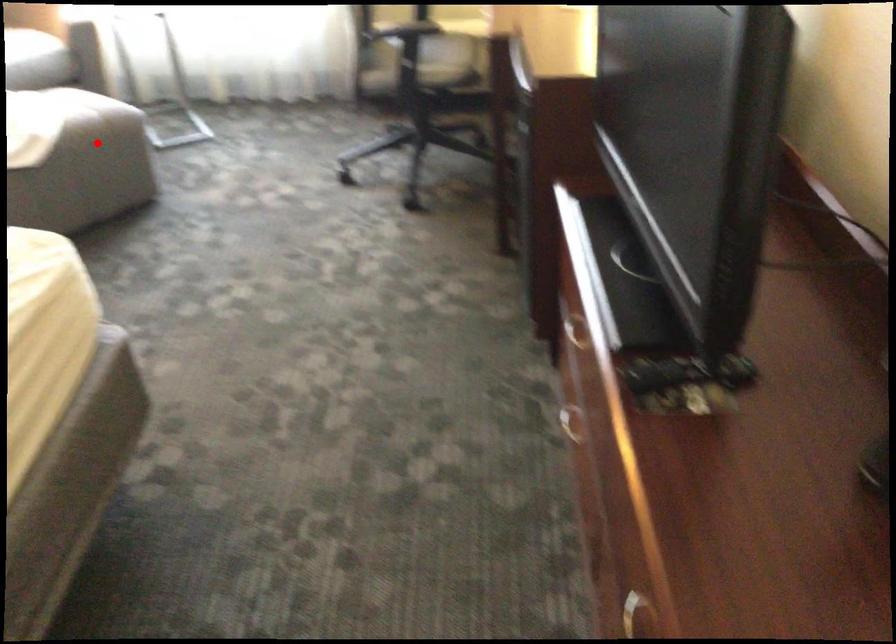
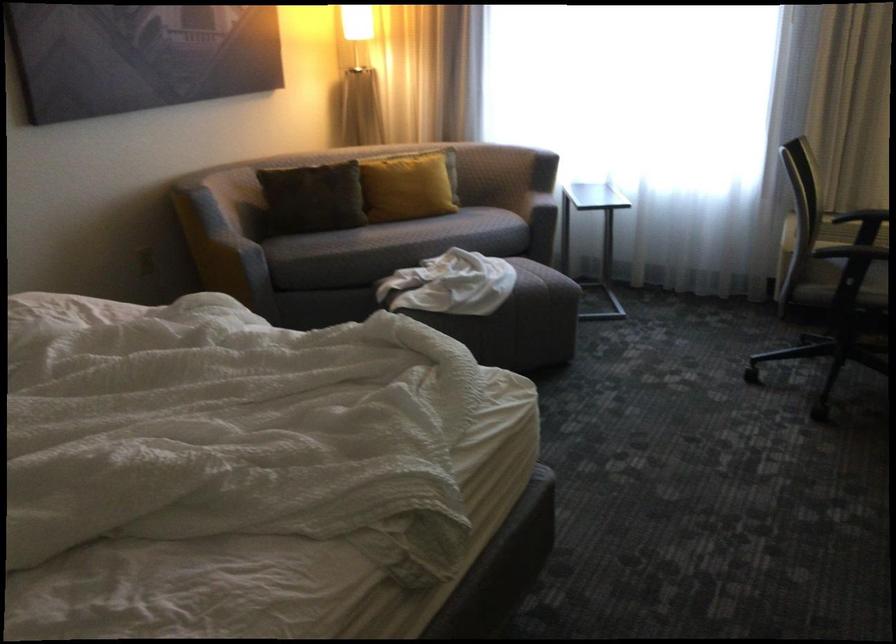
Question: A red point is marked in image1. In image2, is the corresponding 3D point closer to the camera or farther? Reply with the corresponding letter.

Choices:
 (A) The corresponding 3D point is closer.
 (B) The corresponding 3D point is farther.

Answer: (B)